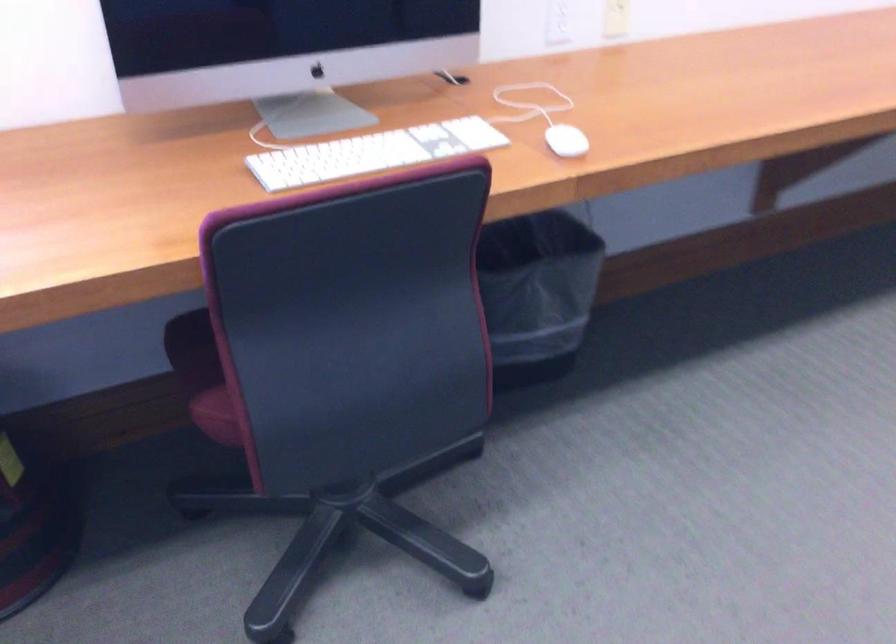
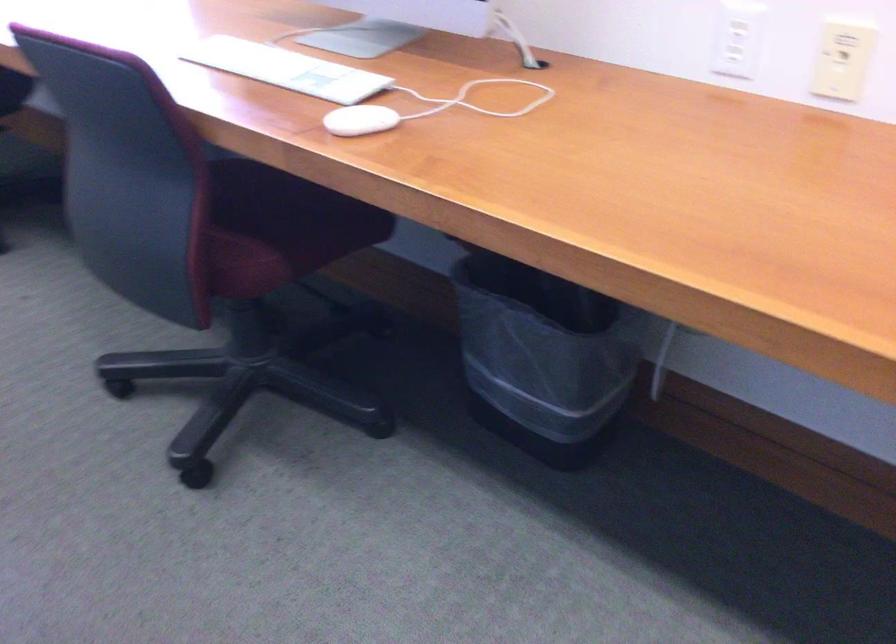
Where in the second image is the point corresponding to [410,308] from the first image?

(273, 228)